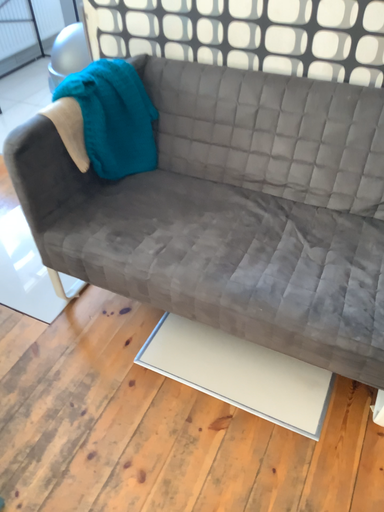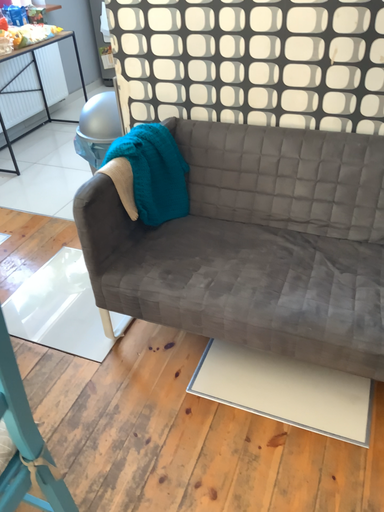
Question: How did the camera likely rotate when shooting the video?

Choices:
 (A) rotated downward
 (B) rotated upward

Answer: (B)